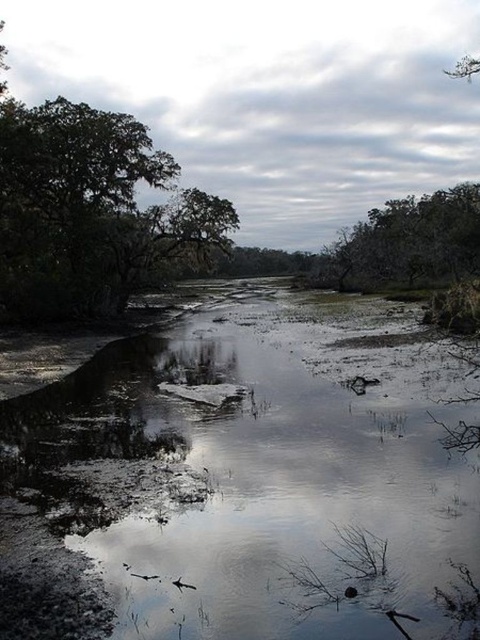
Question: Considering the relative positions of muddy water at center and green leafy tree at upper left in the image provided, where is muddy water at center located with respect to green leafy tree at upper left?

Choices:
 (A) left
 (B) right

Answer: (B)

Question: Where is muddy water at center located in relation to green leafy tree at upper left in the image?

Choices:
 (A) below
 (B) above

Answer: (A)

Question: Which object appears farthest from the camera in this image?

Choices:
 (A) green leafy tree at upper right
 (B) muddy water at center

Answer: (A)

Question: Which point is closer to the camera?

Choices:
 (A) muddy water at center
 (B) green leafy tree at upper left

Answer: (A)

Question: Can you confirm if green leafy tree at upper left is wider than green leafy tree at upper right?

Choices:
 (A) no
 (B) yes

Answer: (B)

Question: Which is farther from the muddy water at center?

Choices:
 (A) green leafy tree at upper left
 (B) green leafy tree at upper right

Answer: (B)